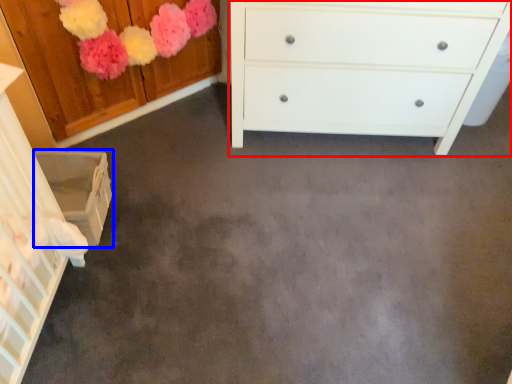
Question: Which object is closer to the camera taking this photo, chest of drawers (highlighted by a red box) or cabinetry (highlighted by a blue box)?

Choices:
 (A) chest of drawers
 (B) cabinetry

Answer: (B)